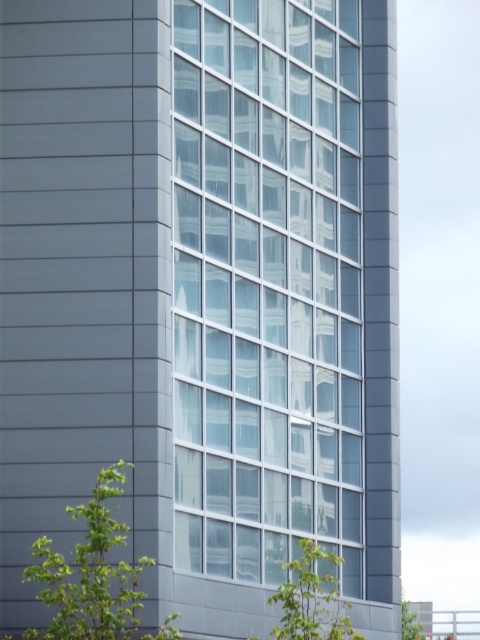
Question: Which point appears closest to the camera in this image?

Choices:
 (A) (129, 616)
 (B) (408, 605)
 (C) (302, 595)

Answer: (A)

Question: Can you confirm if green leafy tree at lower center is bigger than green leafy tree at lower right?

Choices:
 (A) no
 (B) yes

Answer: (A)

Question: Which object is farther from the camera taking this photo?

Choices:
 (A) green leafy tree at lower left
 (B) green leafy tree at lower center

Answer: (A)

Question: Can you confirm if green leafy tree at lower center is positioned below green leafy tree at lower right?

Choices:
 (A) no
 (B) yes

Answer: (A)

Question: Can you confirm if green leafy tree at lower center is positioned to the right of green leafy tree at lower right?

Choices:
 (A) no
 (B) yes

Answer: (A)

Question: Which point is closer to the camera?

Choices:
 (A) green leafy tree at lower center
 (B) green leafy tree at lower left
 (C) green leafy tree at lower right

Answer: (A)